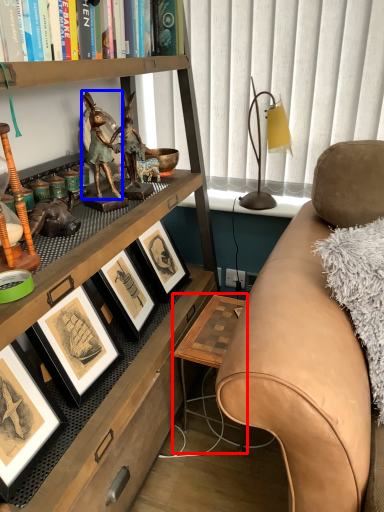
Question: Which point is further to the camera, table (highlighted by a red box) or person (highlighted by a blue box)?

Choices:
 (A) table
 (B) person

Answer: (A)